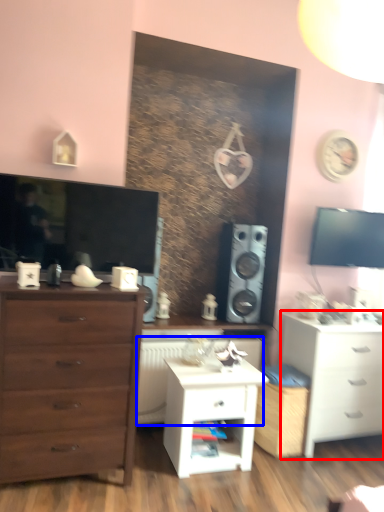
Question: Which object appears closest to the camera in this image, chest of drawers (highlighted by a red box) or radiator (highlighted by a blue box)?

Choices:
 (A) chest of drawers
 (B) radiator

Answer: (A)